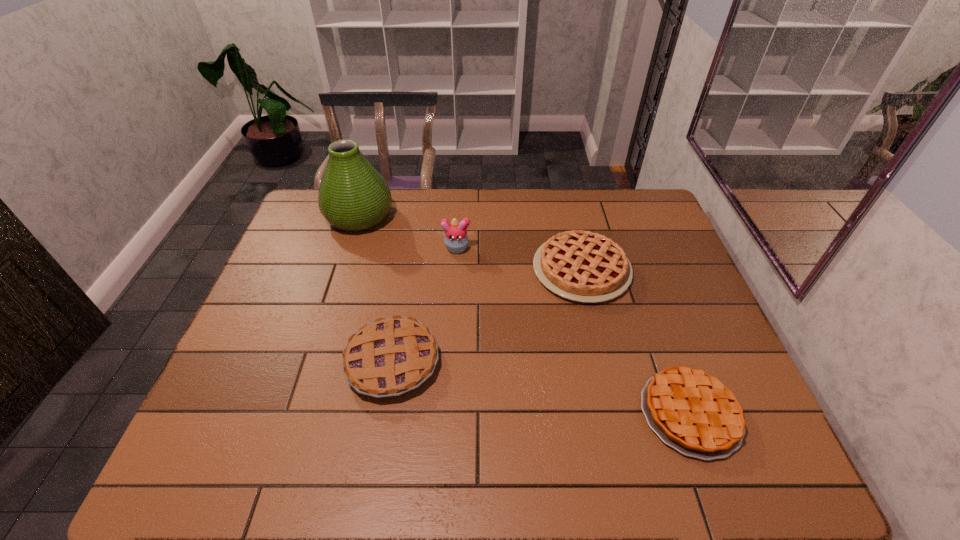
Where is `vacant region between the vase and the leftmost pie`? vacant region between the vase and the leftmost pie is located at coordinates (376, 289).

Locate an element on the screen. free area in between the shortest pie and the tallest object is located at coordinates (525, 315).

Where is `vacant region between the farthest pie and the shortest pie`? The image size is (960, 540). vacant region between the farthest pie and the shortest pie is located at coordinates (636, 341).

Where is `free space between the leftmost pie and the fourth shortest object`? free space between the leftmost pie and the fourth shortest object is located at coordinates (424, 305).

At what (x,y) coordinates should I click in order to perform the action: click on unoccupied area between the leftmost pie and the cupcake. Please return your answer as a coordinate pair (x, y). The width and height of the screenshot is (960, 540). Looking at the image, I should click on (424, 305).

Find the location of a particular element. vacant area that lies between the shortest object and the leftmost pie is located at coordinates (541, 387).

Find the location of a particular element. vacant point located between the second tallest object and the leftmost pie is located at coordinates (424, 305).

Locate an element on the screen. blank region between the cupcake and the farthest pie is located at coordinates (519, 259).

Image resolution: width=960 pixels, height=540 pixels. Identify the location of vacant area between the cupcake and the farthest pie. (519, 259).

You are a GUI agent. You are given a task and a screenshot of the screen. Output one action in this format:
    pyautogui.click(x=<x>, y=<y>)
    Task: Click on the free area in between the tallest object and the shortest pie
    
    Given the screenshot: What is the action you would take?
    pyautogui.click(x=525, y=315)